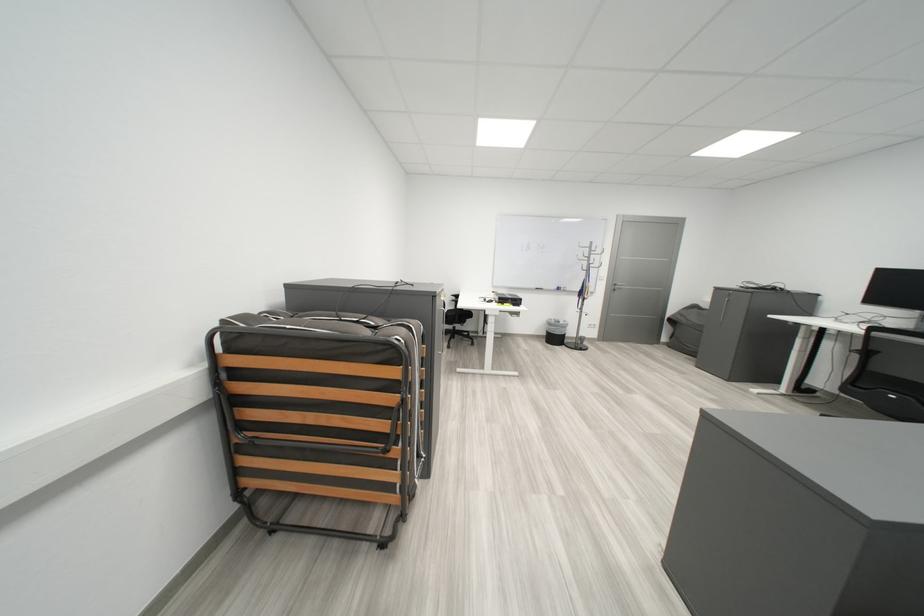
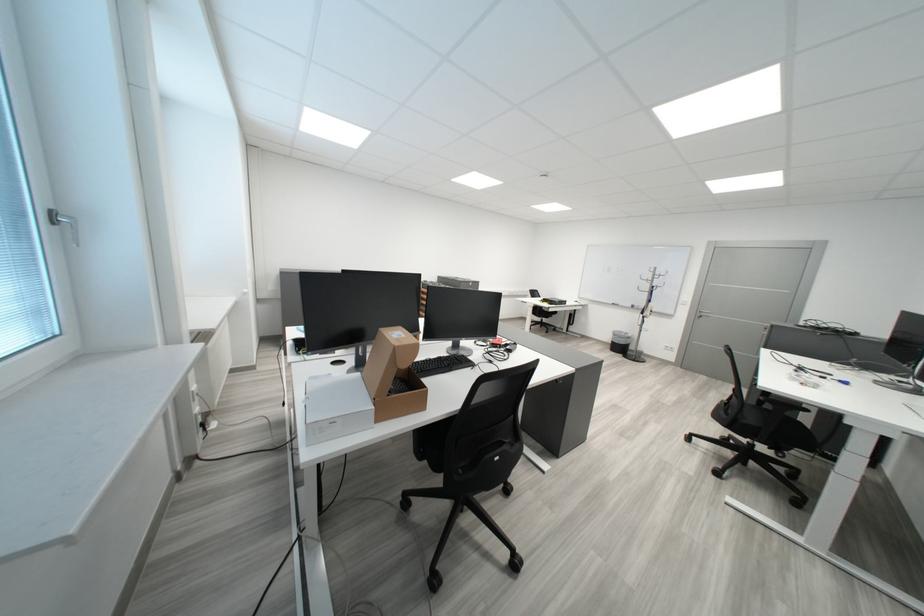
Locate, in the second image, the point that corresponds to the point at 563,326 in the first image.

(627, 336)